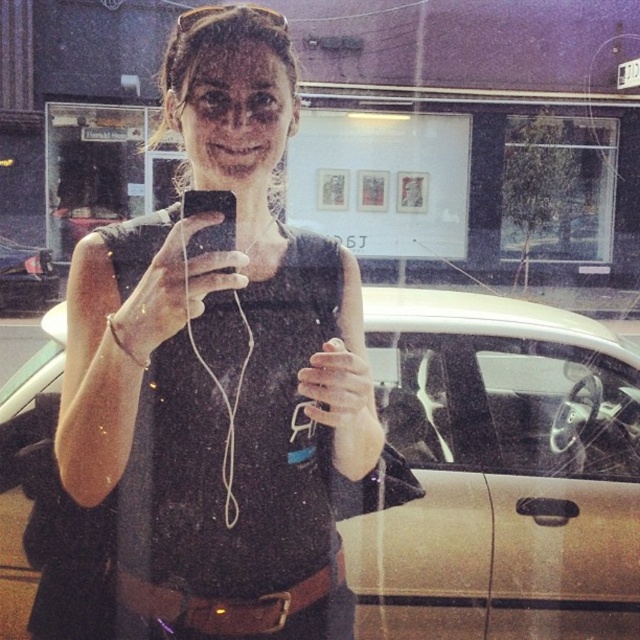
Does black matte tank top at center have a greater width compared to transparent glass steering wheel at center?

No, black matte tank top at center is not wider than transparent glass steering wheel at center.

Can you confirm if black matte tank top at center is shorter than transparent glass steering wheel at center?

In fact, black matte tank top at center may be taller than transparent glass steering wheel at center.

Is point (278, 288) less distant than point (432, 396)?

That is True.

You are a GUI agent. You are given a task and a screenshot of the screen. Output one action in this format:
    pyautogui.click(x=<x>, y=<y>)
    Task: Click on the black matte tank top at center
    Image resolution: width=640 pixels, height=640 pixels.
    Given the screenshot: What is the action you would take?
    pyautogui.click(x=220, y=371)

Who is lower down, gold metallic car at center or transparent glass steering wheel at center?

gold metallic car at center is lower down.

Measure the distance between gold metallic car at center and transparent glass steering wheel at center.

gold metallic car at center and transparent glass steering wheel at center are 8.06 centimeters apart from each other.

You are a GUI agent. You are given a task and a screenshot of the screen. Output one action in this format:
    pyautogui.click(x=<x>, y=<y>)
    Task: Click on the gold metallic car at center
    The height and width of the screenshot is (640, 640).
    Given the screenshot: What is the action you would take?
    pyautogui.click(x=500, y=472)

Does transparent glass steering wheel at center have a lesser width compared to matte black phone at center?

Incorrect, transparent glass steering wheel at center's width is not less than matte black phone at center's.

Which is in front, point (400, 420) or point (218, 241)?

Point (218, 241) is in front.

Locate an element on the screen. The image size is (640, 640). transparent glass steering wheel at center is located at coordinates (506, 404).